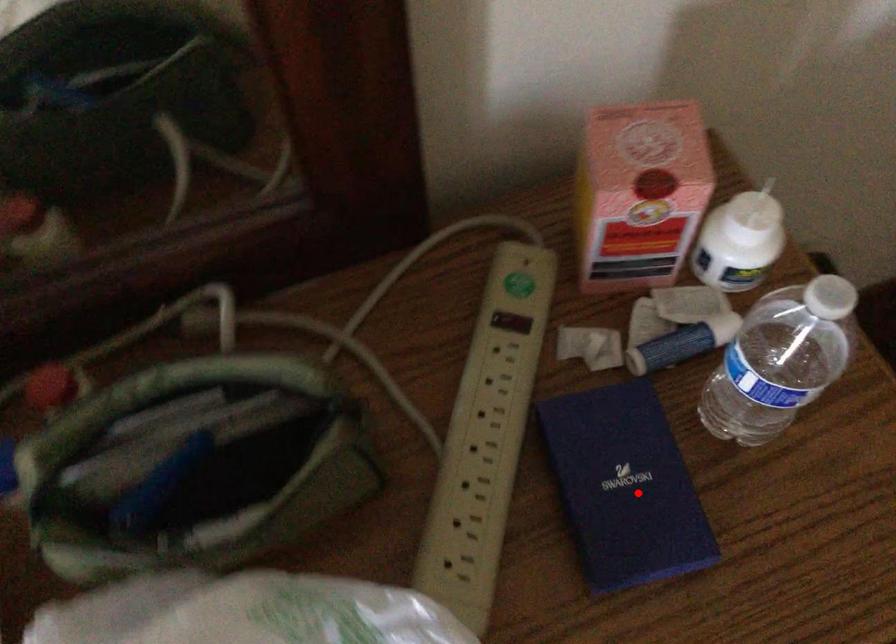
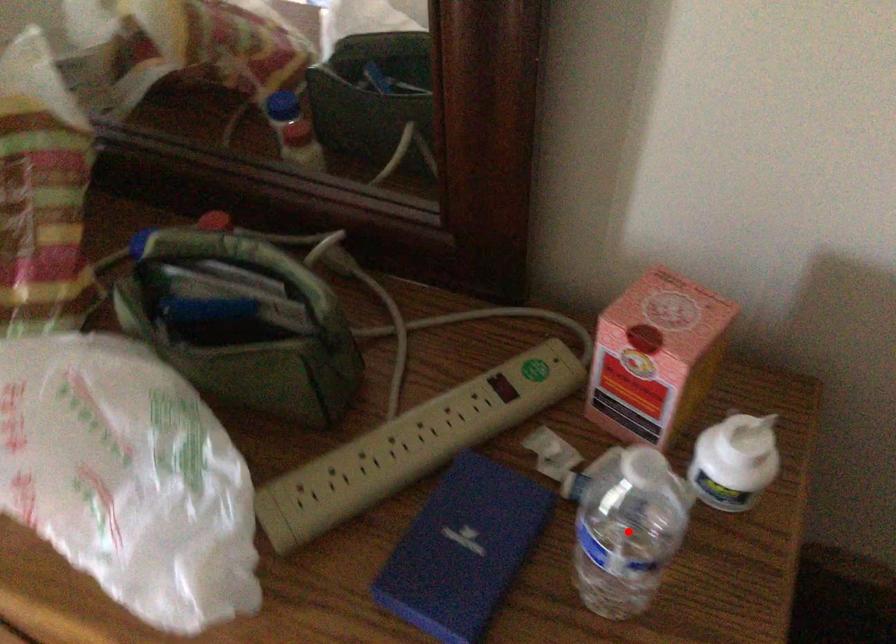
I am providing you with two images of the same scene from different viewpoints. A red point is marked on the first image and another point is marked on the second image. Is the red point in image1 aligned with the point shown in image2?

No